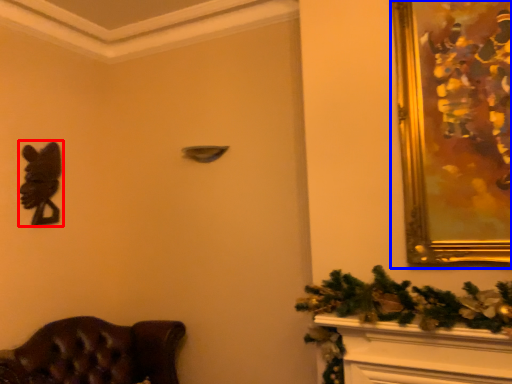
Question: Among these objects, which one is nearest to the camera, animal (highlighted by a red box) or picture frame (highlighted by a blue box)?

Choices:
 (A) animal
 (B) picture frame

Answer: (B)